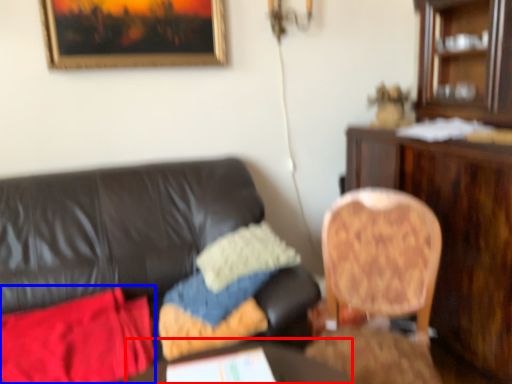
Question: Which object is further to the camera taking this photo, round table (highlighted by a red box) or material (highlighted by a blue box)?

Choices:
 (A) round table
 (B) material

Answer: (B)